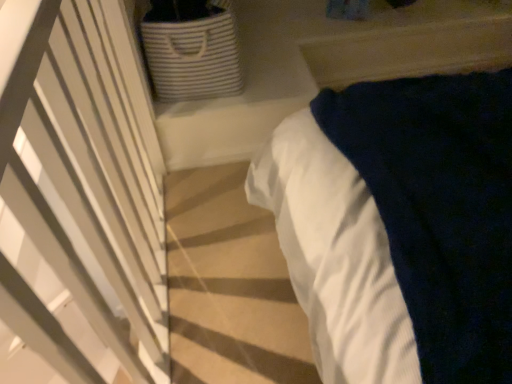
Locate an element on the screen. white fabric bed at upper right is located at coordinates pos(399,227).

Image resolution: width=512 pixels, height=384 pixels. Describe the element at coordinates (399, 227) in the screenshot. I see `white fabric bed at upper right` at that location.

In order to face white fabric bed at upper right, should I rotate leftwards or rightwards?

Turn right by 8.697 degrees to look at white fabric bed at upper right.

At what (x,y) coordinates should I click in order to perform the action: click on white fabric bed at upper right. Please return your answer as a coordinate pair (x, y). The image size is (512, 384). Looking at the image, I should click on (399, 227).